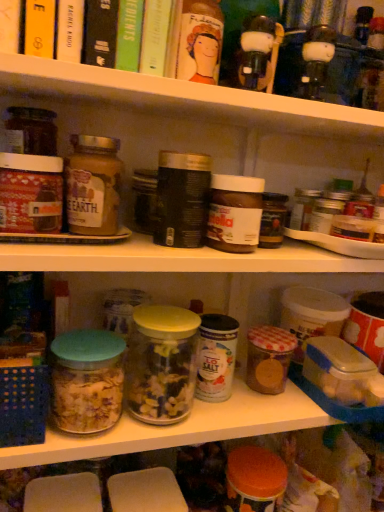
Question: Does matte glass jar at left, which ranks as the first cereal in left-to-right order, have a smaller size compared to matte plastic jars at upper center, placed as the first shelf when sorted from top to bottom?

Choices:
 (A) no
 (B) yes

Answer: (B)

Question: Is matte glass jar at left, acting as the 2th cereal starting from the bottom, thinner than matte plastic jars at upper center, placed as the first shelf when sorted from top to bottom?

Choices:
 (A) yes
 (B) no

Answer: (A)

Question: Is matte glass jar at left, positioned as the 1th cereal in front-to-back order, at the left side of matte plastic jars at upper center, placed as the first shelf when sorted from top to bottom?

Choices:
 (A) no
 (B) yes

Answer: (B)

Question: Would you consider matte glass jar at left, the second cereal viewed from the right, to be distant from matte plastic jars at upper center, placed as the first shelf when sorted from top to bottom?

Choices:
 (A) yes
 (B) no

Answer: (B)

Question: Considering the relative sizes of matte glass jar at left, acting as the second cereal starting from the back, and matte plastic jars at upper center, the 2th shelf ordered from the bottom, in the image provided, is matte glass jar at left, acting as the second cereal starting from the back, wider than matte plastic jars at upper center, the 2th shelf ordered from the bottom,?

Choices:
 (A) yes
 (B) no

Answer: (B)

Question: From their relative heights in the image, would you say translucent glass jar filled with cereal at center, the 2th glass jar in the right-to-left sequence, is taller or shorter than matte glass jar at left, positioned as the 1th cereal in front-to-back order?

Choices:
 (A) short
 (B) tall

Answer: (A)

Question: Based on their positions, is translucent glass jar filled with cereal at center, the first glass jar in the left-to-right sequence, located to the left or right of matte glass jar at left, the second cereal viewed from the right?

Choices:
 (A) right
 (B) left

Answer: (B)

Question: Is translucent glass jar filled with cereal at center, the first glass jar in the left-to-right sequence, wider or thinner than matte glass jar at left, which appears as the first cereal when viewed from the top?

Choices:
 (A) thin
 (B) wide

Answer: (B)

Question: Is translucent glass jar filled with cereal at center, the 2th glass jar in the right-to-left sequence, in front of or behind matte glass jar at left, acting as the second cereal starting from the back, in the image?

Choices:
 (A) behind
 (B) front

Answer: (B)

Question: Based on their positions, is hardcover book at upper left, positioned as the second book in left-to-right order, located to the left or right of translucent glass jar filled with cereal at center, the first glass jar in the left-to-right sequence?

Choices:
 (A) right
 (B) left

Answer: (A)

Question: From the image's perspective, is hardcover book at upper left, positioned as the second book in left-to-right order, located above or below translucent glass jar filled with cereal at center, the first glass jar in the left-to-right sequence?

Choices:
 (A) above
 (B) below

Answer: (A)

Question: Considering the positions of hardcover book at upper left, acting as the 3th book starting from the right, and translucent glass jar filled with cereal at center, the first glass jar in the left-to-right sequence, in the image, is hardcover book at upper left, acting as the 3th book starting from the right, wider or thinner than translucent glass jar filled with cereal at center, the first glass jar in the left-to-right sequence,?

Choices:
 (A) wide
 (B) thin

Answer: (A)

Question: In terms of size, does hardcover book at upper left, positioned as the second book in left-to-right order, appear bigger or smaller than translucent glass jar filled with cereal at center, the first glass jar in the left-to-right sequence?

Choices:
 (A) small
 (B) big

Answer: (B)

Question: From a real-world perspective, relative to matte glass jar at left, acting as the second cereal starting from the back, is matte plastic jars at upper center, placed as the first shelf when sorted from top to bottom, vertically above or below?

Choices:
 (A) above
 (B) below

Answer: (A)

Question: In terms of width, does matte plastic jars at upper center, placed as the first shelf when sorted from top to bottom, look wider or thinner when compared to matte glass jar at left, which ranks as the first cereal in left-to-right order?

Choices:
 (A) thin
 (B) wide

Answer: (B)